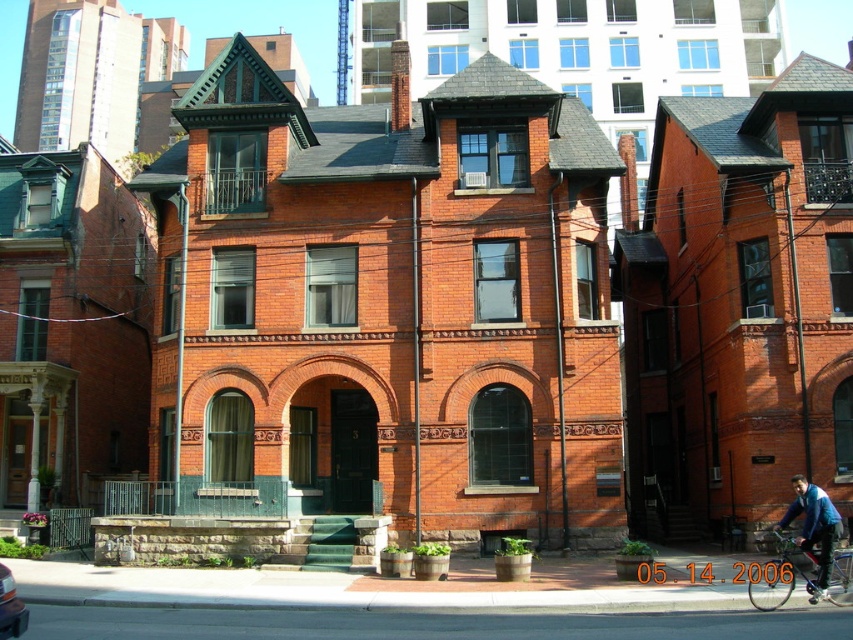
Question: Among these objects, which one is farthest from the camera?

Choices:
 (A) metallic silver car at lower left
 (B) metallic blue bicycle at lower right

Answer: (B)

Question: Can you confirm if blue denim jacket at lower right is thinner than metallic silver car at lower left?

Choices:
 (A) no
 (B) yes

Answer: (A)

Question: Does metallic blue bicycle at lower right appear over metallic silver car at lower left?

Choices:
 (A) yes
 (B) no

Answer: (B)

Question: Which object is the closest to the blue denim jacket at lower right?

Choices:
 (A) metallic silver car at lower left
 (B) metallic blue bicycle at lower right

Answer: (B)

Question: Among these objects, which one is farthest from the camera?

Choices:
 (A) blue denim jacket at lower right
 (B) metallic blue bicycle at lower right

Answer: (B)

Question: Is metallic blue bicycle at lower right to the right of metallic silver car at lower left from the viewer's perspective?

Choices:
 (A) yes
 (B) no

Answer: (A)